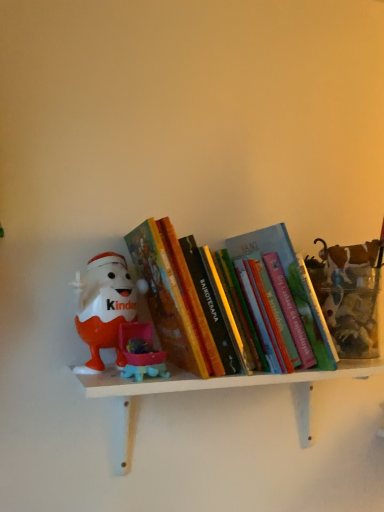
Question: Is hardcover book at center oriented towards white matte shelf at center?

Choices:
 (A) no
 (B) yes

Answer: (A)

Question: Does hardcover book at center have a lesser width compared to white matte shelf at center?

Choices:
 (A) no
 (B) yes

Answer: (A)

Question: Is hardcover book at center positioned in front of white matte shelf at center?

Choices:
 (A) yes
 (B) no

Answer: (B)

Question: Can you confirm if hardcover book at center is shorter than white matte shelf at center?

Choices:
 (A) yes
 (B) no

Answer: (B)

Question: Is hardcover book at center positioned with its back to white matte shelf at center?

Choices:
 (A) yes
 (B) no

Answer: (B)

Question: From the image's perspective, relative to hardcover book at center, is matte plastic kinder egg at left above or below?

Choices:
 (A) above
 (B) below

Answer: (B)

Question: Is matte plastic kinder egg at left situated inside hardcover book at center or outside?

Choices:
 (A) inside
 (B) outside

Answer: (A)

Question: Considering the positions of matte plastic kinder egg at left and hardcover book at center in the image, is matte plastic kinder egg at left wider or thinner than hardcover book at center?

Choices:
 (A) wide
 (B) thin

Answer: (B)

Question: Is point (107, 320) positioned closer to the camera than point (215, 312)?

Choices:
 (A) closer
 (B) farther

Answer: (B)

Question: Does point (142, 238) appear closer or farther from the camera than point (114, 264)?

Choices:
 (A) closer
 (B) farther

Answer: (A)

Question: In the image, is hardcover book at center positioned in front of or behind matte plastic kinder egg at left?

Choices:
 (A) front
 (B) behind

Answer: (A)

Question: Choose the correct answer: Is hardcover book at center inside matte plastic kinder egg at left or outside it?

Choices:
 (A) outside
 (B) inside

Answer: (A)

Question: Based on their sizes in the image, would you say hardcover book at center is bigger or smaller than matte plastic kinder egg at left?

Choices:
 (A) big
 (B) small

Answer: (A)

Question: Considering the positions of white matte shelf at center and hardcover book at center in the image, is white matte shelf at center taller or shorter than hardcover book at center?

Choices:
 (A) short
 (B) tall

Answer: (A)

Question: Based on their positions, is white matte shelf at center located to the left or right of hardcover book at center?

Choices:
 (A) left
 (B) right

Answer: (B)